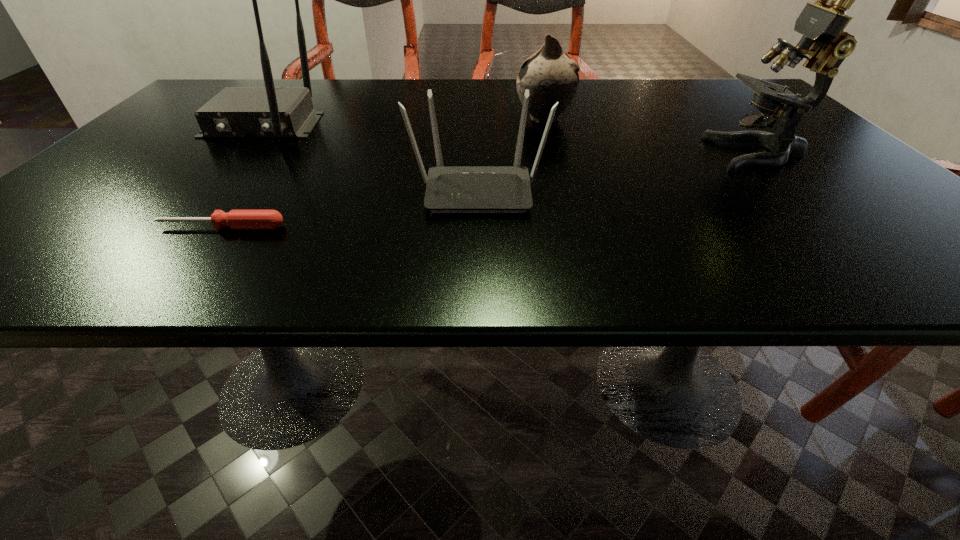
Locate an element on the screen. free point that satisfies the following two spatial constraints: 1. at the eyepieces of the microscope; 2. on the front-facing side of the second shortest object is located at coordinates (795, 190).

Where is `vacant space that satisfies the following two spatial constraints: 1. at the eyepieces of the microscope; 2. on the front-facing side of the nearer router`? The height and width of the screenshot is (540, 960). vacant space that satisfies the following two spatial constraints: 1. at the eyepieces of the microscope; 2. on the front-facing side of the nearer router is located at coordinates pyautogui.click(x=795, y=190).

Identify the location of free region that satisfies the following two spatial constraints: 1. on the back of the screwdriver to connect cables; 2. on the right side of the farther router. (172, 227).

Where is `free space that satisfies the following two spatial constraints: 1. at the eyepieces of the microscope; 2. on the front-facing side of the shorter router`? free space that satisfies the following two spatial constraints: 1. at the eyepieces of the microscope; 2. on the front-facing side of the shorter router is located at coordinates (795, 190).

Where is `vacant region that satisfies the following two spatial constraints: 1. at the eyepieces of the microscope; 2. on the front-facing side of the right router`? This screenshot has height=540, width=960. vacant region that satisfies the following two spatial constraints: 1. at the eyepieces of the microscope; 2. on the front-facing side of the right router is located at coordinates (795, 190).

Where is `free space that satisfies the following two spatial constraints: 1. at the eyepieces of the rightmost object; 2. on the front-facing side of the fourth tallest object`? free space that satisfies the following two spatial constraints: 1. at the eyepieces of the rightmost object; 2. on the front-facing side of the fourth tallest object is located at coordinates (795, 190).